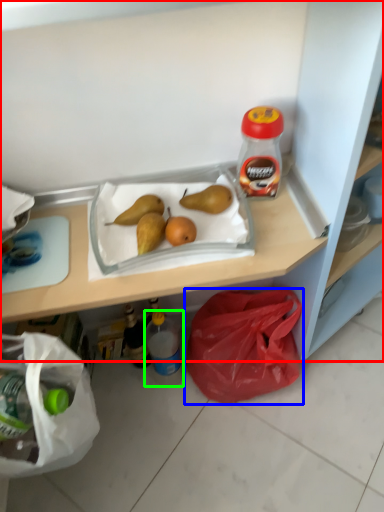
Question: Which object is the farthest from shelf (highlighted by a red box)? Choose among these: plastic bag (highlighted by a blue box) or bottle (highlighted by a green box).

Choices:
 (A) plastic bag
 (B) bottle

Answer: (B)